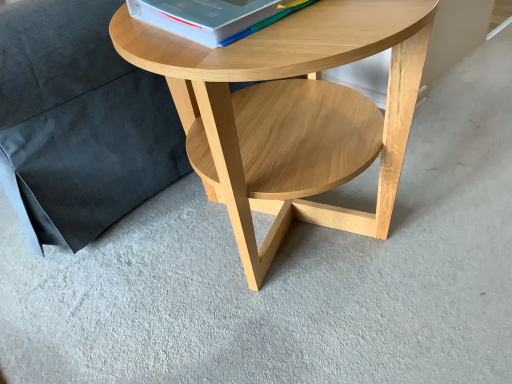
You are a GUI agent. You are given a task and a screenshot of the screen. Output one action in this format:
    pyautogui.click(x=<x>, y=<y>)
    Task: Click on the free space that is to the left of natural wood coffee table at center
    The height and width of the screenshot is (384, 512).
    Given the screenshot: What is the action you would take?
    pyautogui.click(x=115, y=281)